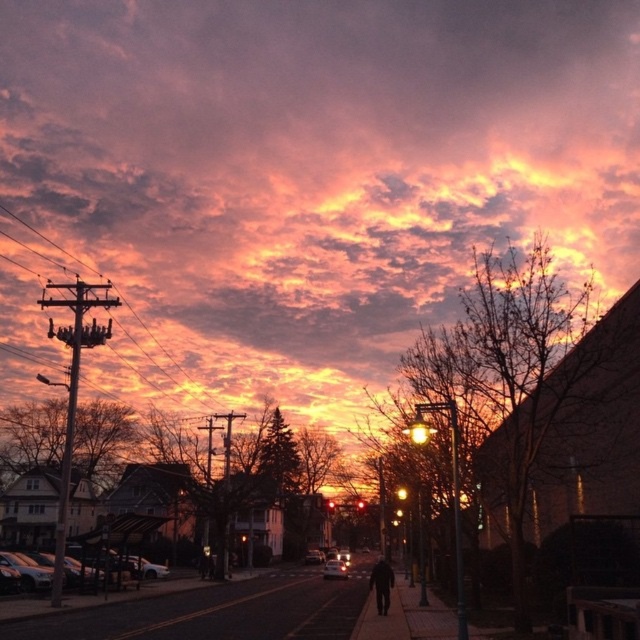
Question: Which point is farther to the camera?

Choices:
 (A) (316, 588)
 (B) (326, 566)
 (C) (88, 579)
 (D) (376, 598)

Answer: (B)

Question: Is shiny silver car at lower left above black matte jacket at center?

Choices:
 (A) no
 (B) yes

Answer: (A)

Question: Estimate the real-world distances between objects in this image. Which object is closer to the shiny silver car at lower left?

Choices:
 (A) shiny silver sedan at center
 (B) black matte jacket at center

Answer: (B)

Question: Can you confirm if dark asphalt road at lower center is wider than shiny silver car at lower left?

Choices:
 (A) yes
 (B) no

Answer: (A)

Question: Which point is closer to the camera?

Choices:
 (A) (381, 602)
 (B) (323, 570)

Answer: (A)

Question: Considering the relative positions of dark asphalt road at lower center and shiny silver car at lower left in the image provided, where is dark asphalt road at lower center located with respect to shiny silver car at lower left?

Choices:
 (A) below
 (B) above

Answer: (B)